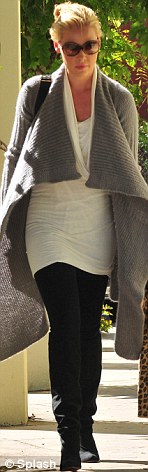
At what (x,y) coordinates should I click in order to perform the action: click on white column. Please return your answer as a coordinate pair (x, y). Looking at the image, I should click on (3, 5), (12, 411), (5, 412), (20, 400), (10, 25), (14, 366).